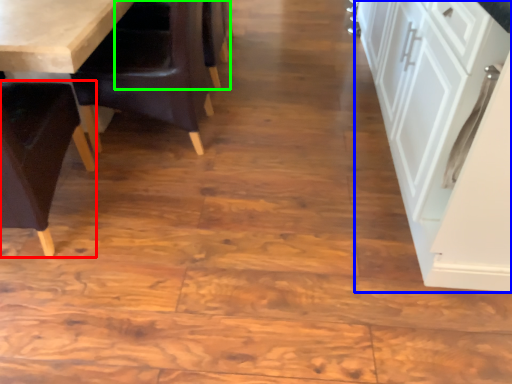
Question: Which object is positioned farthest from chair (highlighted by a red box)? Select from cabinetry (highlighted by a blue box) and armchair (highlighted by a green box).

Choices:
 (A) cabinetry
 (B) armchair

Answer: (A)